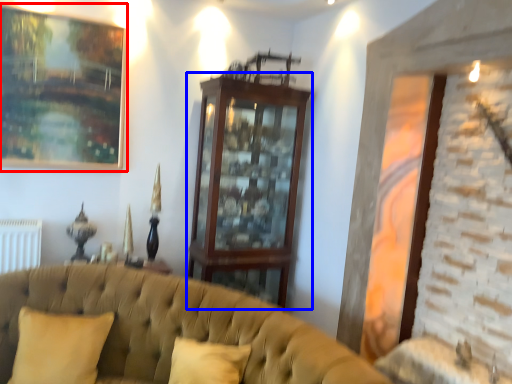
Question: Which object appears farthest to the camera in this image, picture frame (highlighted by a red box) or dresser (highlighted by a blue box)?

Choices:
 (A) picture frame
 (B) dresser

Answer: (B)